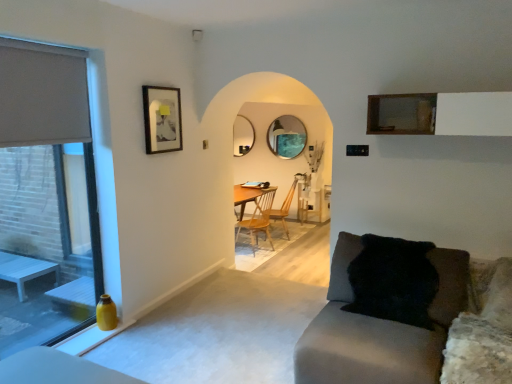
Question: Considering the relative sizes of wooden at center, acting as the 1th chair starting from the front, and matte glass window at left in the image provided, is wooden at center, acting as the 1th chair starting from the front, smaller than matte glass window at left?

Choices:
 (A) yes
 (B) no

Answer: (B)

Question: From the image's perspective, would you say wooden at center, the second chair in the back-to-front sequence, is positioned over matte glass window at left?

Choices:
 (A) no
 (B) yes

Answer: (A)

Question: Could matte glass window at left be considered to be inside wooden at center, the second chair in the back-to-front sequence?

Choices:
 (A) yes
 (B) no

Answer: (B)

Question: From a real-world perspective, is wooden at center, acting as the 1th chair starting from the front, beneath matte glass window at left?

Choices:
 (A) yes
 (B) no

Answer: (A)

Question: Is wooden at center, acting as the 1th chair starting from the front, positioned far away from matte glass window at left?

Choices:
 (A) no
 (B) yes

Answer: (B)

Question: From a real-world perspective, relative to matte black picture frame at upper left, is wooden at center, the second chair in the back-to-front sequence, vertically above or below?

Choices:
 (A) below
 (B) above

Answer: (A)

Question: Considering the positions of wooden at center, the second chair in the back-to-front sequence, and matte black picture frame at upper left in the image, is wooden at center, the second chair in the back-to-front sequence, taller or shorter than matte black picture frame at upper left?

Choices:
 (A) short
 (B) tall

Answer: (B)

Question: Is point (253, 248) positioned closer to the camera than point (178, 142)?

Choices:
 (A) farther
 (B) closer

Answer: (A)

Question: Considering the positions of wooden at center, the second chair in the back-to-front sequence, and matte black picture frame at upper left in the image, is wooden at center, the second chair in the back-to-front sequence, bigger or smaller than matte black picture frame at upper left?

Choices:
 (A) big
 (B) small

Answer: (A)

Question: From a real-world perspective, is wooden at center, acting as the 1th chair starting from the front, physically located above or below wooden chair at center, positioned as the second chair in front-to-back order?

Choices:
 (A) below
 (B) above

Answer: (A)

Question: Relative to wooden chair at center, positioned as the second chair in front-to-back order, is wooden at center, acting as the 1th chair starting from the front, in front or behind?

Choices:
 (A) front
 (B) behind

Answer: (A)

Question: Considering the positions of wooden at center, the second chair in the back-to-front sequence, and wooden chair at center, the first chair when ordered from back to front, in the image, is wooden at center, the second chair in the back-to-front sequence, bigger or smaller than wooden chair at center, the first chair when ordered from back to front,?

Choices:
 (A) big
 (B) small

Answer: (A)

Question: Looking at their shapes, would you say wooden at center, acting as the 1th chair starting from the front, is wider or thinner than wooden chair at center, positioned as the second chair in front-to-back order?

Choices:
 (A) wide
 (B) thin

Answer: (A)

Question: In terms of width, does matte glass window at left look wider or thinner when compared to matte black picture frame at upper left?

Choices:
 (A) wide
 (B) thin

Answer: (B)

Question: Is matte glass window at left taller or shorter than matte black picture frame at upper left?

Choices:
 (A) short
 (B) tall

Answer: (B)